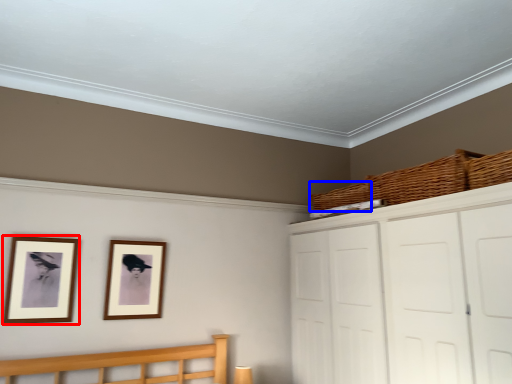
Question: Which object is further to the camera taking this photo, picture frame (highlighted by a red box) or basket (highlighted by a blue box)?

Choices:
 (A) picture frame
 (B) basket

Answer: (B)